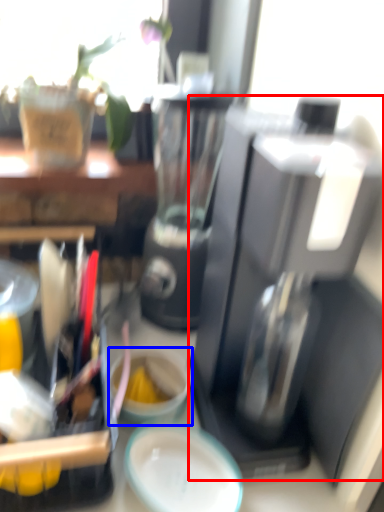
Question: Which of the following is the farthest to the observer, coffee maker (highlighted by a red box) or coffee cup (highlighted by a blue box)?

Choices:
 (A) coffee maker
 (B) coffee cup

Answer: (B)